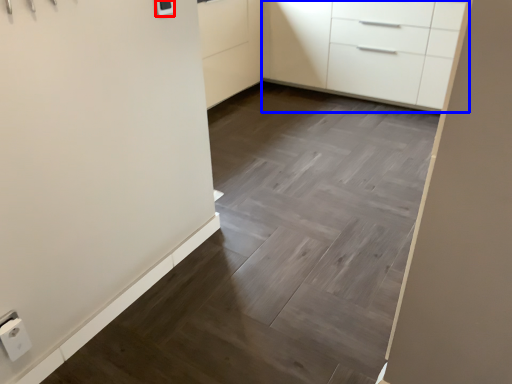
Question: Which object is further to the camera taking this photo, light switch (highlighted by a red box) or chest of drawers (highlighted by a blue box)?

Choices:
 (A) light switch
 (B) chest of drawers

Answer: (B)